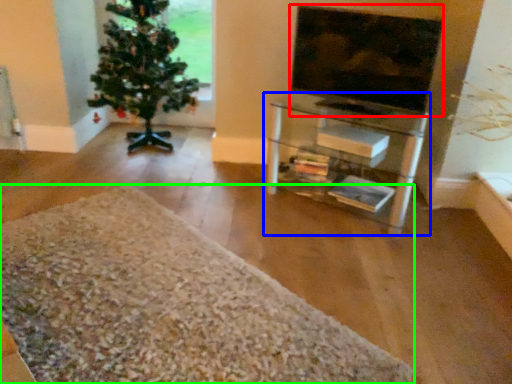
Question: Estimate the real-world distances between objects in this image. Which object is closer to television (highlighted by a red box), shelf (highlighted by a blue box) or gravel (highlighted by a green box)?

Choices:
 (A) shelf
 (B) gravel

Answer: (A)